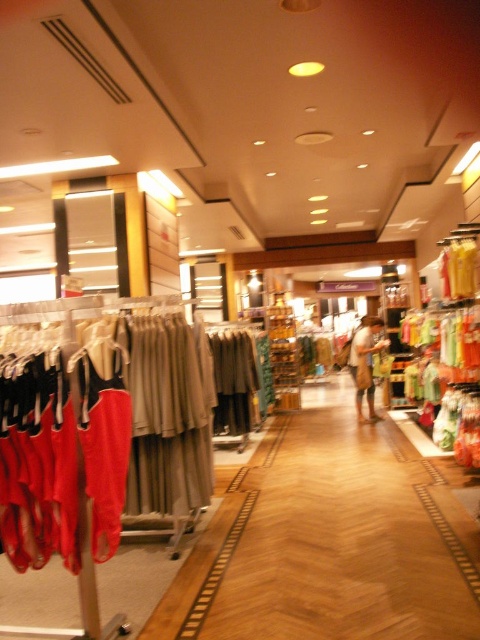
Question: Does matte red dress at left appear on the right side of matte beige dress at center?

Choices:
 (A) no
 (B) yes

Answer: (A)

Question: Is matte red dress at left closer to the viewer compared to matte beige dress at center?

Choices:
 (A) yes
 (B) no

Answer: (A)

Question: Which object appears closest to the camera in this image?

Choices:
 (A) matte red dress at left
 (B) matte beige dress at center
 (C) brown textured bag at center

Answer: (A)

Question: Which point appears closest to the camera in this image?

Choices:
 (A) (364, 374)
 (B) (172, 467)
 (C) (360, 323)

Answer: (B)

Question: Does brown textured bag at center appear on the right side of matte beige dress at center?

Choices:
 (A) yes
 (B) no

Answer: (A)

Question: Which object is farther from the camera taking this photo?

Choices:
 (A) matte beige dress at center
 (B) matte red dress at left

Answer: (A)